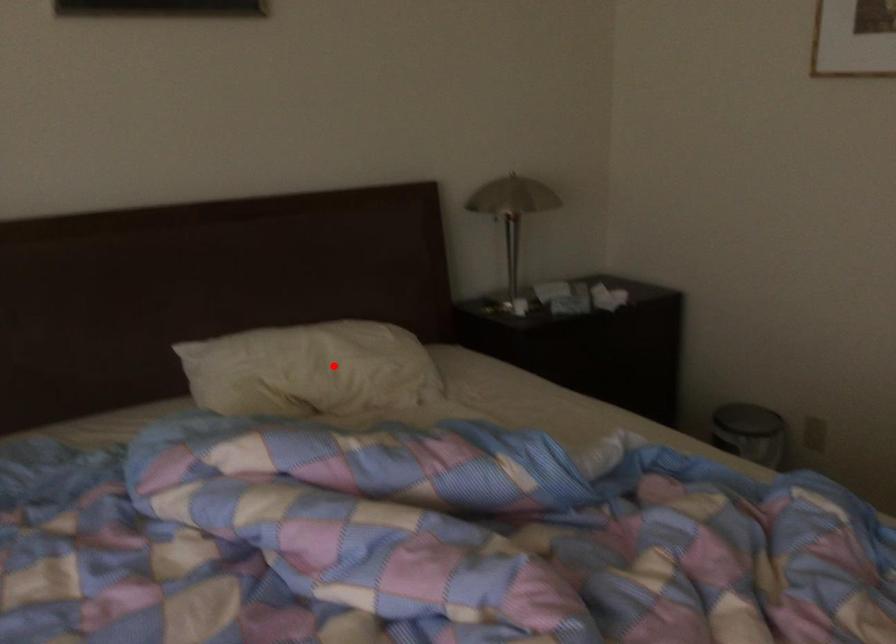
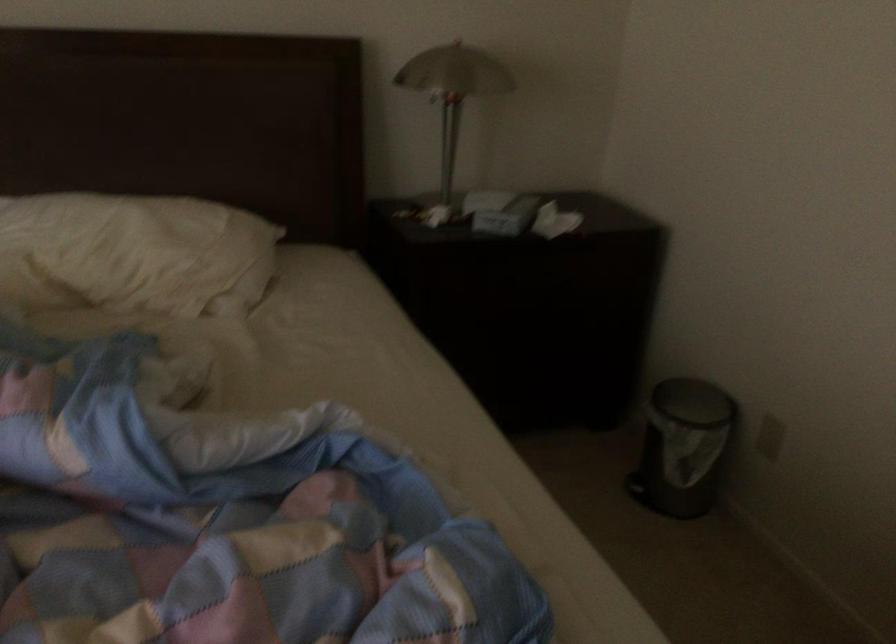
Question: A red point is marked in image1. In image2, is the corresponding 3D point closer to the camera or farther? Reply with the corresponding letter.

Choices:
 (A) The corresponding 3D point is closer.
 (B) The corresponding 3D point is farther.

Answer: (A)